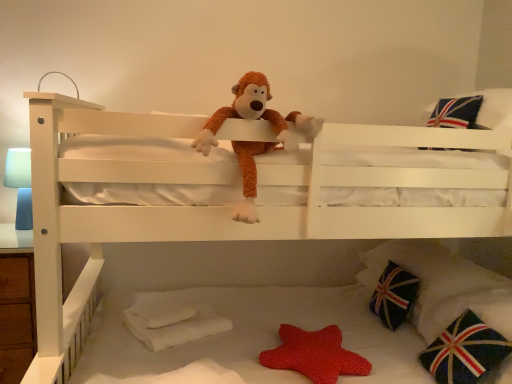
Question: Looking at their shapes, would you say red dotted fabric star at lower center, which appears as the first toy when ordered from the bottom, is wider or thinner than dark blue fabric pillow with union jack design at lower right, arranged as the 3th pillow when ordered from the bottom?

Choices:
 (A) wide
 (B) thin

Answer: (B)

Question: Is red dotted fabric star at lower center, which appears as the first toy when ordered from the bottom, taller or shorter than dark blue fabric pillow with union jack design at lower right, the second pillow when ordered from top to bottom?

Choices:
 (A) short
 (B) tall

Answer: (A)

Question: Which is farther from the red dotted fabric star at lower center, the 2th toy positioned from the top?

Choices:
 (A) dark blue fabric pillow with union jack design at lower right, marked as the 1th pillow in a bottom-to-top arrangement
 (B) fluffy brown monkey at center, the second toy ordered from the bottom
 (C) dark blue fabric pillow with union jack design at lower right, the second pillow when ordered from top to bottom
 (D) dark blue fabric pillow with union jack design at lower right, which is the second pillow in bottom-to-top order
 (E) soft plush monkey at center

Answer: (B)

Question: Based on their relative distances, which object is nearer to the blue matte table lamp at left?

Choices:
 (A) dark blue fabric pillow with union jack design at lower right, the second pillow when ordered from top to bottom
 (B) red dotted fabric star at lower center, the 1th toy from the back
 (C) dark blue fabric pillow with union jack design at lower right, marked as the 1th pillow in a bottom-to-top arrangement
 (D) soft plush monkey at center
 (E) dark blue fabric pillow with union jack design at lower right, the third pillow in the top-to-bottom sequence

Answer: (D)